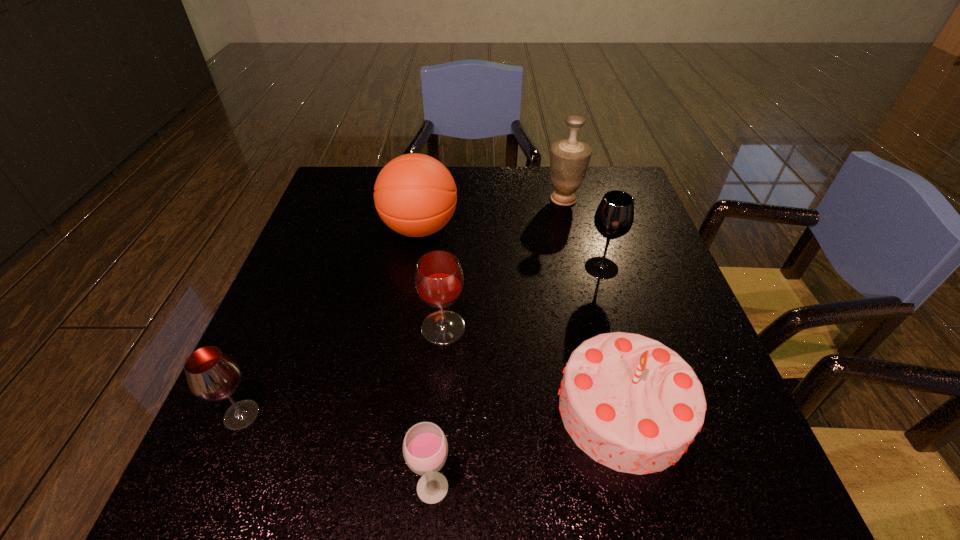
Identify the location of free space located on the front of the basketball. (408, 300).

Where is `vacant space located on the back of the fifth nearest object`? The image size is (960, 540). vacant space located on the back of the fifth nearest object is located at coordinates (591, 232).

I want to click on free space located 0.250m on the left of the fourth farthest object, so click(305, 328).

Locate an element on the screen. This screenshot has height=540, width=960. vacant space located 0.130m on the back of the birthday cake is located at coordinates (598, 308).

At what (x,y) coordinates should I click in order to perform the action: click on free point located on the back of the leftmost object. Please return your answer as a coordinate pair (x, y). The width and height of the screenshot is (960, 540). Looking at the image, I should click on (288, 306).

Where is `blank space located on the right of the nearest wineglass`? This screenshot has width=960, height=540. blank space located on the right of the nearest wineglass is located at coordinates (694, 487).

The width and height of the screenshot is (960, 540). I want to click on urn at the far edge, so click(x=569, y=158).

At what (x,y) coordinates should I click in order to perform the action: click on basketball that is at the far edge. Please return your answer as a coordinate pair (x, y). Looking at the image, I should click on (415, 195).

Identify the location of birthday cake present at the near edge. The height and width of the screenshot is (540, 960). (631, 403).

Image resolution: width=960 pixels, height=540 pixels. What are the coordinates of `wineglass at the near edge` in the screenshot? It's located at (425, 448).